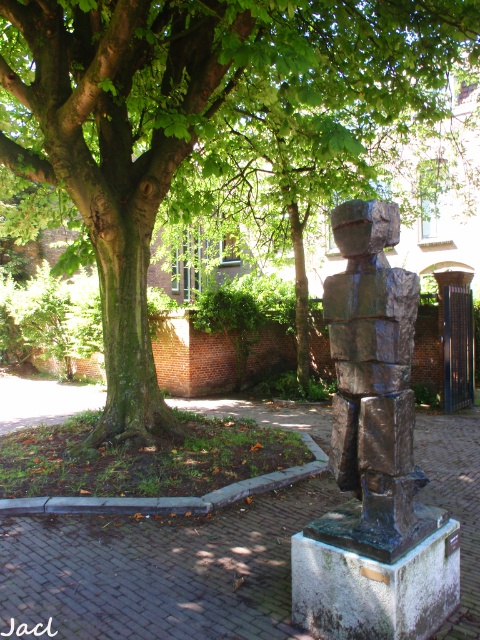
You are a landscape architect planning to place a new bench between the green leafy tree at center and the bronze statue at center. Based on their widths, which object should the bench be closer to?

The green leafy tree at center is narrower than the bronze statue at center, so the bench should be placed closer to the bronze statue at center to maintain balance in the design.

You are standing at the base of the sculpture and want to walk to the point labeled point [120,365]. Will you pass by point [406,369] on your way there?

Yes, because point [120,365] is behind point [406,369], so you will pass by point [406,369] on your way to point [120,365].

You are standing in the outdoor area and want to take a photo of both the green leafy tree at center and the bronze statue at center. Which object should you focus on first to ensure both are in the frame?

You should focus on the bronze statue at center first because the green leafy tree at center is closer to you, so adjusting focus starting from the closer object ensures both are in the frame.